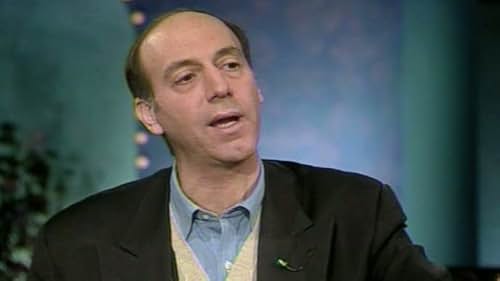
I want to click on lights, so click(140, 168), click(137, 141), click(137, 14).